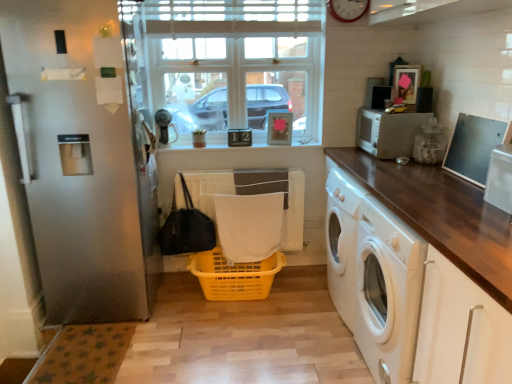
Find the location of `unoccupied region to the right of satin silver screen door at left`. unoccupied region to the right of satin silver screen door at left is located at coordinates (203, 326).